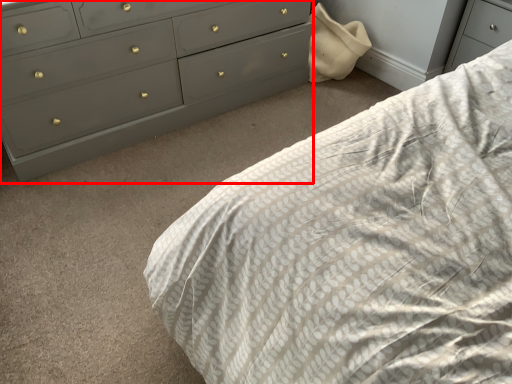
Question: From the image, what is the correct spatial relationship of chest of drawers (annotated by the red box) in relation to bed?

Choices:
 (A) right
 (B) left

Answer: (B)